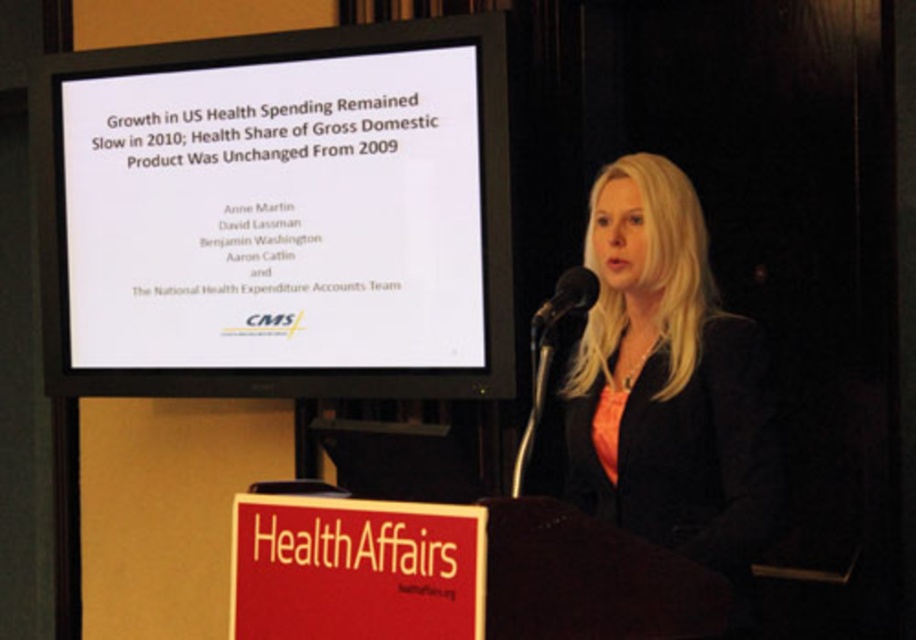
Question: Is white glossy projector screen at upper center further to camera compared to black matte microphone at center?

Choices:
 (A) no
 (B) yes

Answer: (B)

Question: Which of the following is the closest to the observer?

Choices:
 (A) white glossy projector screen at upper center
 (B) blonde hair at center

Answer: (B)

Question: Which object is closer to the camera taking this photo?

Choices:
 (A) blonde hair at center
 (B) black matte microphone at center
 (C) white glossy projector screen at upper center

Answer: (A)

Question: Can you confirm if blonde hair at center is wider than black matte microphone at center?

Choices:
 (A) yes
 (B) no

Answer: (A)

Question: Does white glossy projector screen at upper center have a greater width compared to black matte microphone at center?

Choices:
 (A) no
 (B) yes

Answer: (B)

Question: Which of the following is the closest to the observer?

Choices:
 (A) white glossy projector screen at upper center
 (B) black matte microphone at center
 (C) blonde hair at center

Answer: (C)